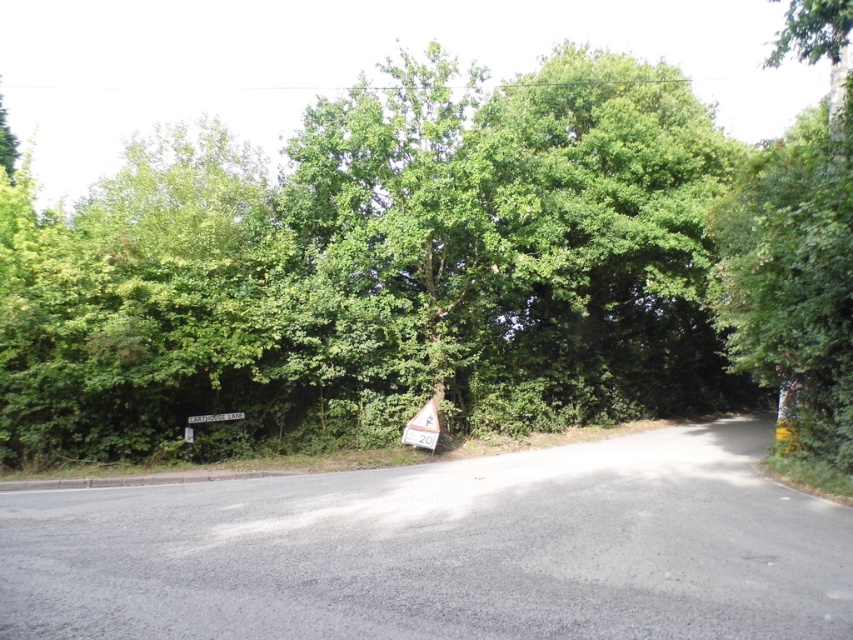
Is green leafy tree at center wider than white plastic sign at center?

Yes, green leafy tree at center is wider than white plastic sign at center.

Between green leafy tree at center and white plastic sign at center, which one is positioned higher?

Positioned higher is green leafy tree at center.

Is point (740, 371) less distant than point (432, 408)?

Yes, it is.

Locate an element on the screen. The height and width of the screenshot is (640, 853). green leafy tree at center is located at coordinates (434, 272).